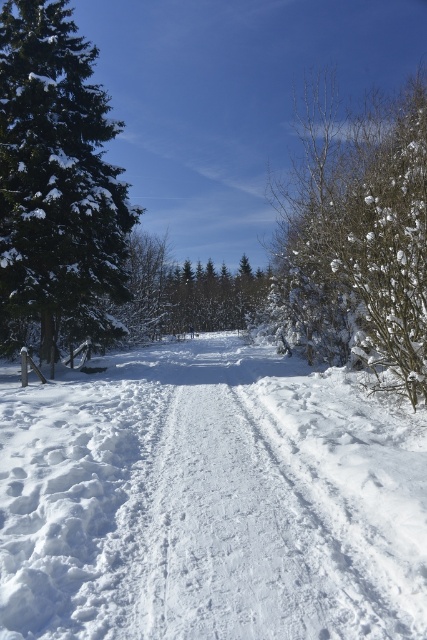
You are an observer standing at the edge of the winter landscape. You notice the white fluffy snow at center and the green textured pine tree at left. Which object is closer to the ground?

The white fluffy snow at center is closer to the ground because it is located below the green textured pine tree at left.

You are standing at the point marked as point (56, 186) in the winter landscape. Looking around, you see a green textured pine tree at left and deciduous trees at right. Which direction should you walk to find the nearest deciduous tree?

You should walk towards the right from point (56, 186) to reach the nearest deciduous trees, as the deciduous trees are located to the right side of the green textured pine tree at left.